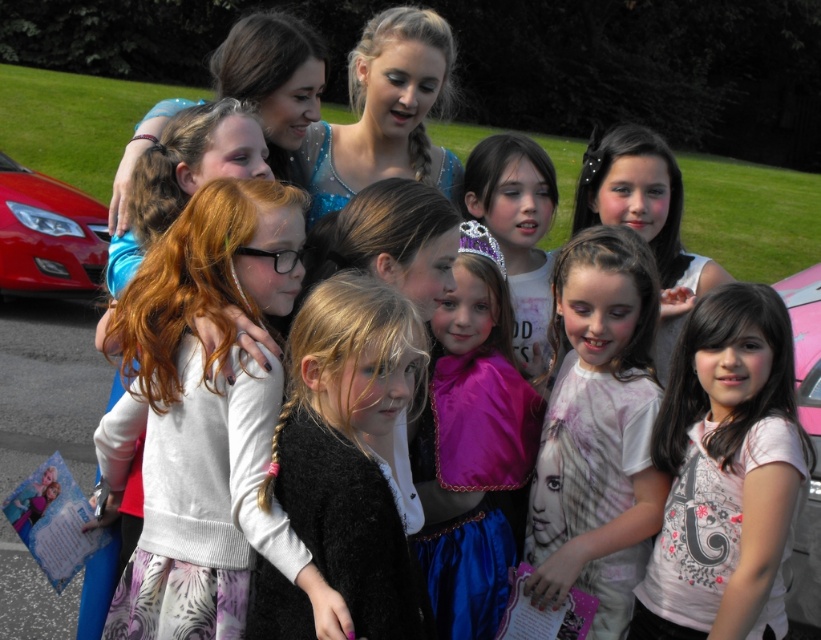
Between pink satin cape at center and shiny blue dress at center, which one appears on the right side from the viewer's perspective?

shiny blue dress at center

You are a GUI agent. You are given a task and a screenshot of the screen. Output one action in this format:
    pyautogui.click(x=<x>, y=<y>)
    Task: Click on the pink satin cape at center
    Image resolution: width=821 pixels, height=640 pixels.
    Given the screenshot: What is the action you would take?
    pyautogui.click(x=471, y=444)

Is point (502, 164) less distant than point (15, 182)?

Yes, point (502, 164) is in front of point (15, 182).

Can you confirm if purple satin dress at center is shorter than shiny red car at left?

Correct, purple satin dress at center is not as tall as shiny red car at left.

Locate an element on the screen. This screenshot has height=640, width=821. purple satin dress at center is located at coordinates (517, 230).

Is white sweater at center behind purple satin dress at center?

No.

Who is more forward, (104, 429) or (544, 264)?

Point (104, 429) is more forward.

In order to click on white sweater at center in this screenshot , I will do `click(207, 420)`.